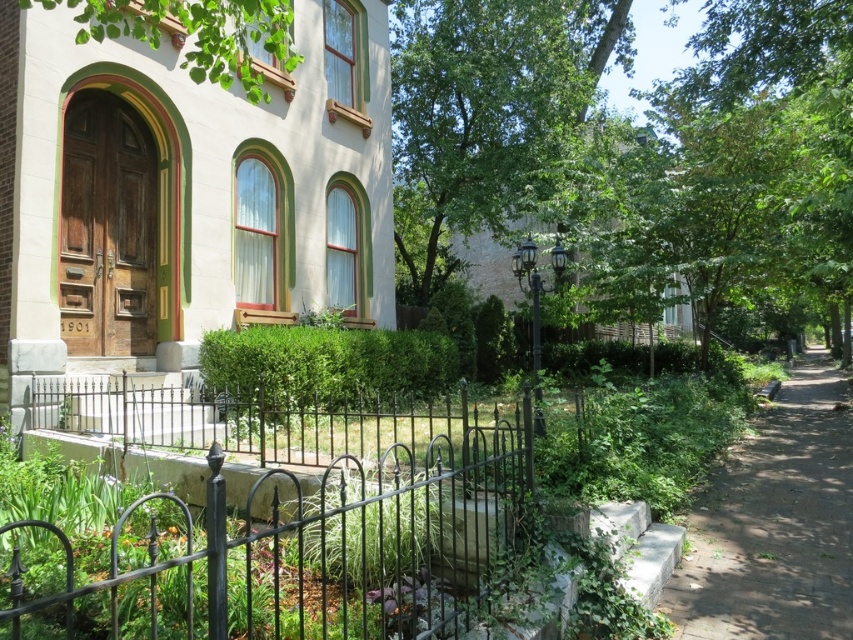
You are standing in front of the house and want to walk to the dirt path at right. Which direction should you face to reach it?

You should face towards the right side of the house to reach the dirt path at right.